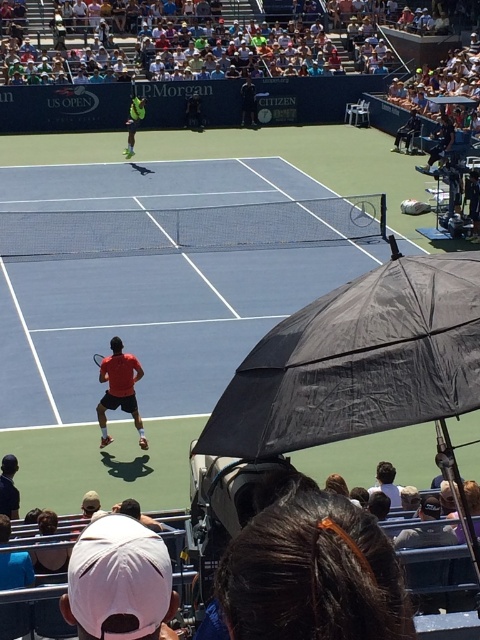
Does brown hair at lower center have a lesser height compared to dark blue fabric wheelchair at upper right?

Indeed, brown hair at lower center has a lesser height compared to dark blue fabric wheelchair at upper right.

You are a GUI agent. You are given a task and a screenshot of the screen. Output one action in this format:
    pyautogui.click(x=<x>, y=<y>)
    Task: Click on the brown hair at lower center
    The width and height of the screenshot is (480, 640).
    Given the screenshot: What is the action you would take?
    pyautogui.click(x=312, y=573)

Does point (110, 339) come closer to viewer compared to point (2, 472)?

No, it is behind (2, 472).

Can you confirm if red matte tennis player at lower left is thinner than dark blue shirt at lower left?

Incorrect, red matte tennis player at lower left's width is not less than dark blue shirt at lower left's.

Is point (108, 371) more distant than point (14, 461)?

Yes, it is behind point (14, 461).

I want to click on red matte tennis player at lower left, so click(120, 388).

The width and height of the screenshot is (480, 640). What do you see at coordinates (362, 212) in the screenshot?
I see `black rubber tennis racket at center` at bounding box center [362, 212].

From the picture: Is black rubber tennis racket at center above matte black racket at center?

Yes.

Does point (371, 212) come closer to viewer compared to point (99, 358)?

That is False.

Locate an element on the screen. This screenshot has width=480, height=640. black rubber tennis racket at center is located at coordinates (362, 212).